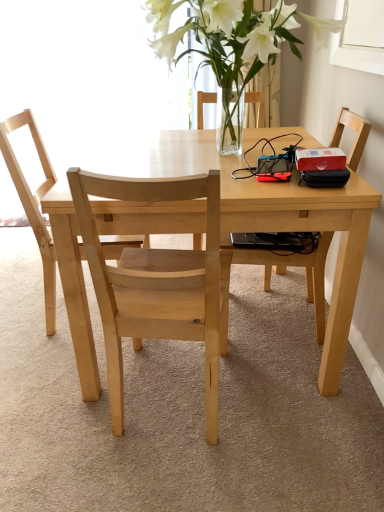
Question: Is there a large distance between natural wood chair at center, the 1th chair viewed from the left, and natural wood chair at center, which is the second chair from left to right?

Choices:
 (A) no
 (B) yes

Answer: (A)

Question: From a real-world perspective, is natural wood chair at center, the 3th chair from the right, positioned under natural wood chair at center, which is the second chair from left to right, based on gravity?

Choices:
 (A) yes
 (B) no

Answer: (B)

Question: From the image's perspective, is natural wood chair at center, the 1th chair viewed from the left, above natural wood chair at center, which is the second chair from left to right?

Choices:
 (A) yes
 (B) no

Answer: (A)

Question: Would you say natural wood chair at center, the 3th chair from the right, contains natural wood chair at center, which appears as the 2th chair when viewed from the right?

Choices:
 (A) no
 (B) yes

Answer: (A)

Question: Considering the relative positions of natural wood chair at center, the 3th chair from the right, and natural wood chair at center, which is the second chair from left to right, in the image provided, is natural wood chair at center, the 3th chair from the right, in front of natural wood chair at center, which is the second chair from left to right,?

Choices:
 (A) yes
 (B) no

Answer: (B)

Question: Considering their positions, is light wood table at center located in front of or behind light brown wooden chair at right, which ranks as the first chair in right-to-left order?

Choices:
 (A) front
 (B) behind

Answer: (A)

Question: Considering the relative positions of light wood table at center and light brown wooden chair at right, the third chair when ordered from left to right, in the image provided, is light wood table at center to the left or to the right of light brown wooden chair at right, the third chair when ordered from left to right,?

Choices:
 (A) left
 (B) right

Answer: (A)

Question: Is light wood table at center inside or outside of light brown wooden chair at right, the third chair when ordered from left to right?

Choices:
 (A) inside
 (B) outside

Answer: (B)

Question: Considering the positions of point (317, 217) and point (306, 273), is point (317, 217) closer or farther from the camera than point (306, 273)?

Choices:
 (A) closer
 (B) farther

Answer: (A)

Question: Looking at the image, does natural wood chair at center, which appears as the 2th chair when viewed from the right, seem bigger or smaller compared to clear glass vase at upper center?

Choices:
 (A) big
 (B) small

Answer: (B)

Question: From a real-world perspective, relative to clear glass vase at upper center, is natural wood chair at center, which appears as the 2th chair when viewed from the right, vertically above or below?

Choices:
 (A) below
 (B) above

Answer: (A)

Question: From their relative heights in the image, would you say natural wood chair at center, which is the second chair from left to right, is taller or shorter than clear glass vase at upper center?

Choices:
 (A) short
 (B) tall

Answer: (B)

Question: Looking at their shapes, would you say natural wood chair at center, which is the second chair from left to right, is wider or thinner than clear glass vase at upper center?

Choices:
 (A) wide
 (B) thin

Answer: (B)

Question: Based on their positions, is clear glass vase at upper center located to the left or right of light wood table at center?

Choices:
 (A) left
 (B) right

Answer: (B)

Question: In terms of width, does clear glass vase at upper center look wider or thinner when compared to light wood table at center?

Choices:
 (A) wide
 (B) thin

Answer: (B)